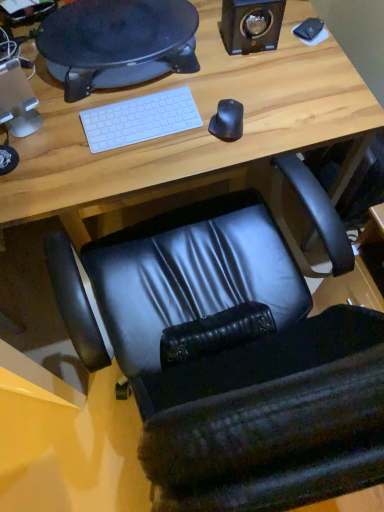
This screenshot has height=512, width=384. I want to click on vacant space underneath white matte keyboard at center (from a real-world perspective), so click(135, 130).